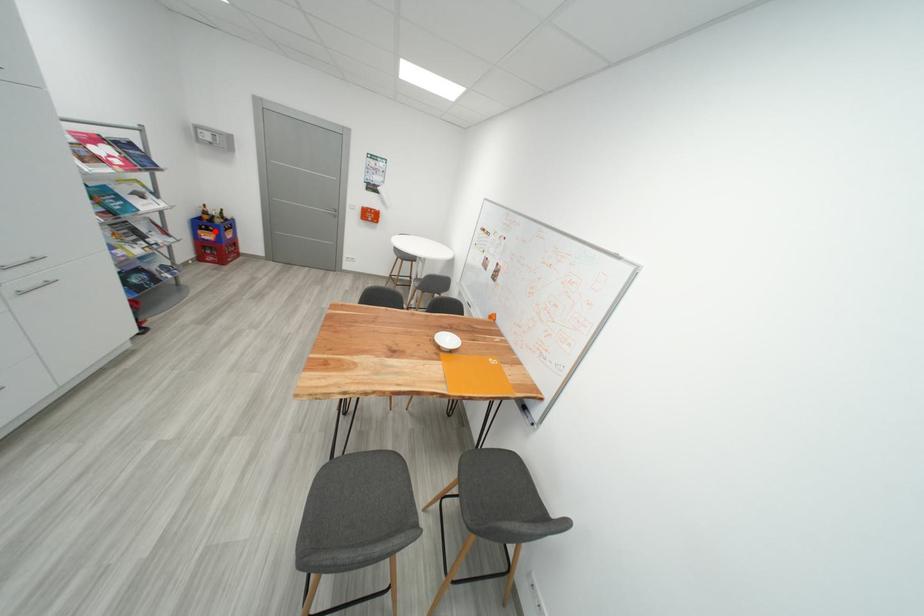
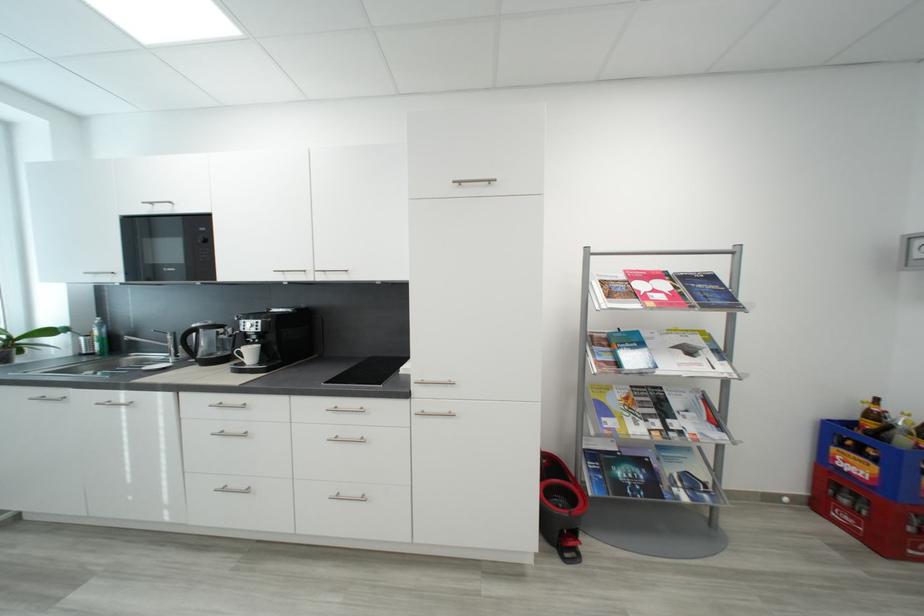
The point at the highlighted location is marked in the first image. Where is the corresponding point in the second image?

(867, 454)